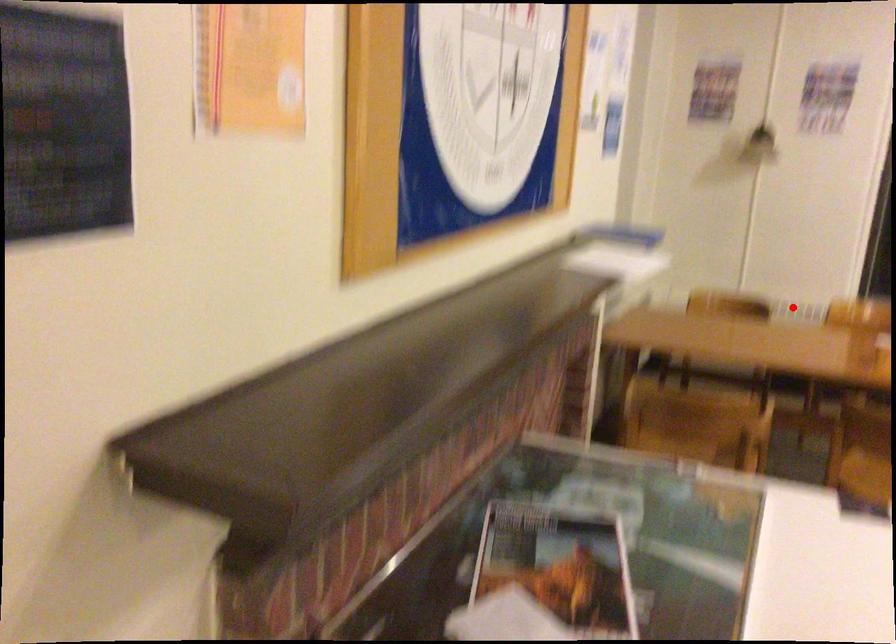
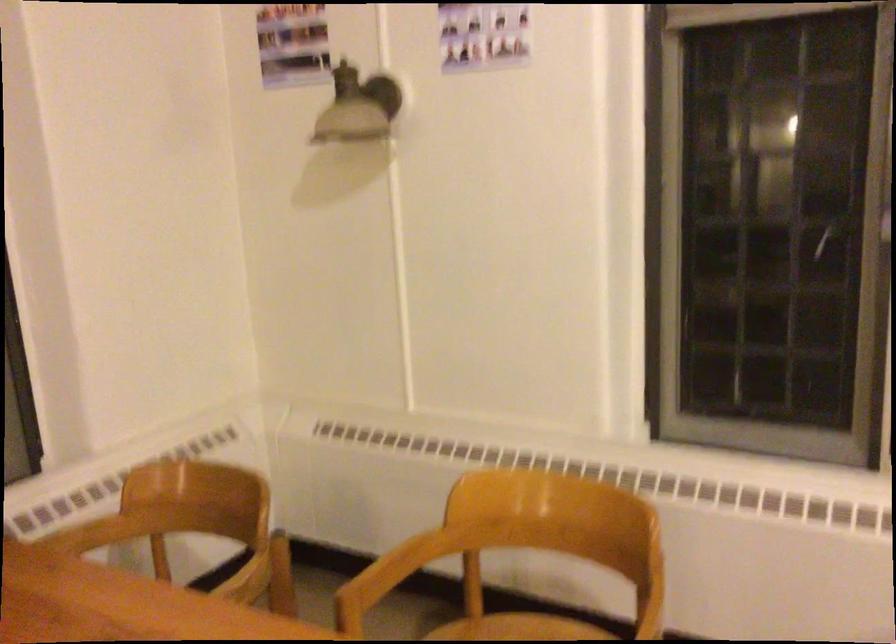
Locate, in the second image, the point that corresponds to the highlighted location in the first image.

(389, 574)